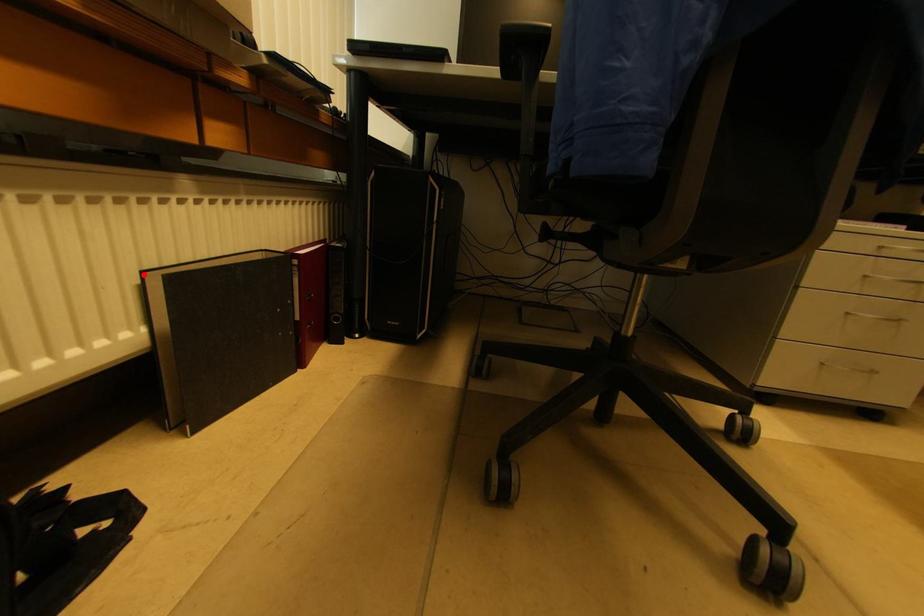
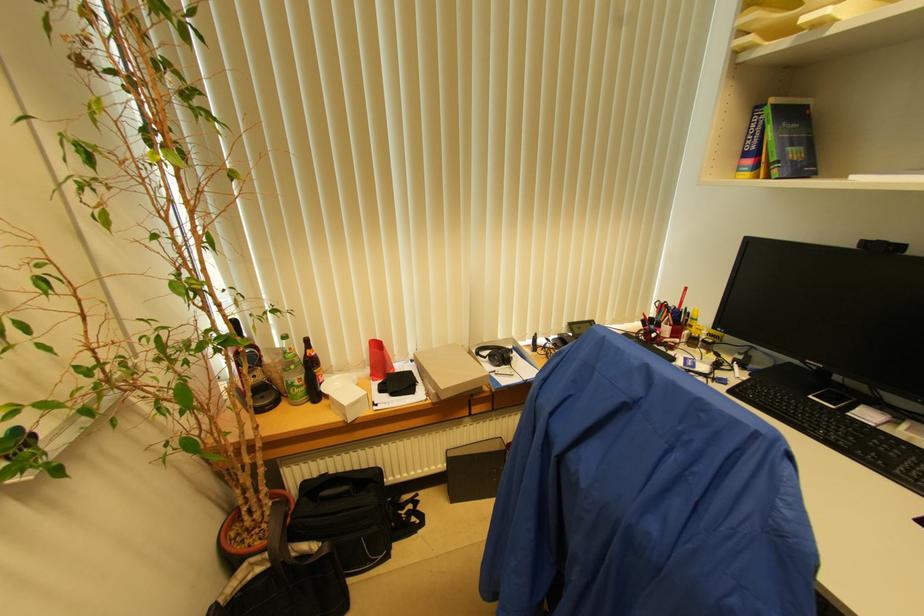
The point at the highlighted location is marked in the first image. Where is the corresponding point in the second image?

(447, 453)